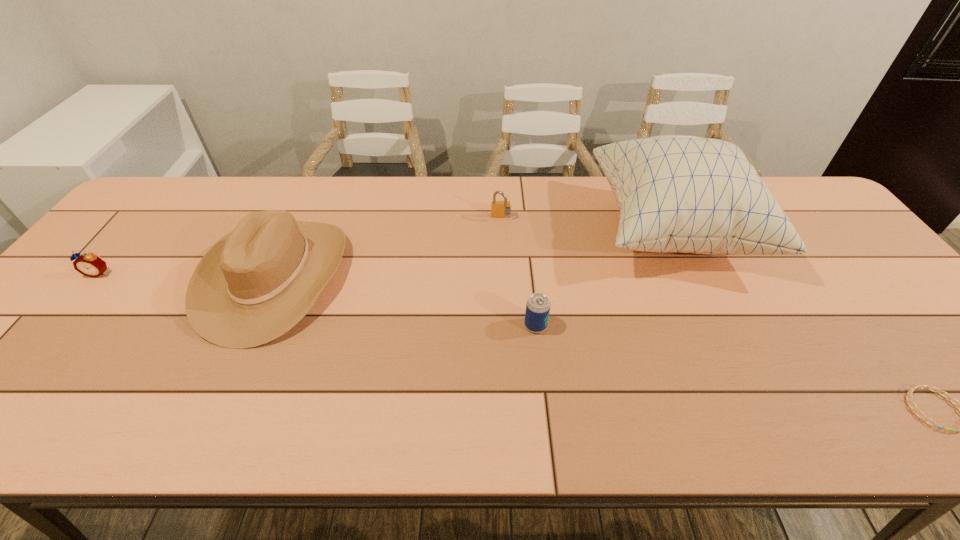
Image resolution: width=960 pixels, height=540 pixels. What are the coordinates of `vacant area that lies between the fifth object from right to left and the tallest object` in the screenshot? It's located at (473, 253).

The width and height of the screenshot is (960, 540). What are the coordinates of `free space between the fourth object from right to left and the fourth object from left to right` in the screenshot? It's located at (518, 272).

Locate an element on the screen. vacant area between the cushion and the leftmost object is located at coordinates (385, 252).

At what (x,y) coordinates should I click in order to perform the action: click on free space between the fifth object from right to left and the cushion. Please return your answer as a coordinate pair (x, y). The width and height of the screenshot is (960, 540). Looking at the image, I should click on (473, 253).

Find the location of `free space between the third object from left to right and the tallest object`. free space between the third object from left to right and the tallest object is located at coordinates (587, 224).

Where is `free space between the cowboy hat and the beer can`? This screenshot has height=540, width=960. free space between the cowboy hat and the beer can is located at coordinates (405, 301).

What are the coordinates of `free space that is in between the second object from left to right and the third object from left to right` in the screenshot? It's located at (388, 247).

The image size is (960, 540). Find the location of `the third closest object to the third object from right to left`. the third closest object to the third object from right to left is located at coordinates (253, 285).

Locate which object is the fifth closest to the third object from left to right. Please provide its 2D coordinates. Your answer should be formatted as a tuple, i.e. [(x, y)], where the tuple contains the x and y coordinates of a point satisfying the conditions above.

[(88, 264)]

Identify the location of blank space that satisfies the following two spatial constraints: 1. on the front side of the cowboy hat; 2. on the right side of the beer can. (253, 326).